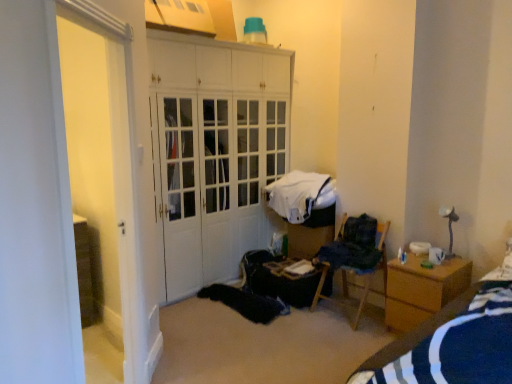
Question: Is the depth of wooden nightstand at right less than that of blue striped fabric at lower right?

Choices:
 (A) yes
 (B) no

Answer: (B)

Question: Is wooden nightstand at right with blue striped fabric at lower right?

Choices:
 (A) yes
 (B) no

Answer: (B)

Question: Is wooden nightstand at right shorter than blue striped fabric at lower right?

Choices:
 (A) no
 (B) yes

Answer: (B)

Question: Considering the relative positions of wooden nightstand at right and blue striped fabric at lower right in the image provided, is wooden nightstand at right to the left of blue striped fabric at lower right from the viewer's perspective?

Choices:
 (A) no
 (B) yes

Answer: (A)

Question: Is wooden nightstand at right not inside blue striped fabric at lower right?

Choices:
 (A) yes
 (B) no

Answer: (A)

Question: Is blue striped fabric at lower right located within wooden nightstand at right?

Choices:
 (A) yes
 (B) no

Answer: (B)

Question: Can you confirm if wooden nightstand at right is taller than white fabric at center, arranged as the second clothing when viewed from the front?

Choices:
 (A) yes
 (B) no

Answer: (A)

Question: Could you tell me if wooden nightstand at right is facing white fabric at center, the first clothing from the back?

Choices:
 (A) no
 (B) yes

Answer: (A)

Question: From a real-world perspective, is wooden nightstand at right physically below white fabric at center, arranged as the second clothing when viewed from the front?

Choices:
 (A) yes
 (B) no

Answer: (A)

Question: Can you confirm if wooden nightstand at right is wider than white fabric at center, the first clothing from the back?

Choices:
 (A) yes
 (B) no

Answer: (B)

Question: Considering the relative sizes of wooden nightstand at right and white fabric at center, arranged as the second clothing when viewed from the front, in the image provided, is wooden nightstand at right smaller than white fabric at center, arranged as the second clothing when viewed from the front,?

Choices:
 (A) no
 (B) yes

Answer: (B)

Question: Considering the relative positions of wooden nightstand at right and white fabric at center, arranged as the second clothing when viewed from the front, in the image provided, is wooden nightstand at right to the right of white fabric at center, arranged as the second clothing when viewed from the front, from the viewer's perspective?

Choices:
 (A) no
 (B) yes

Answer: (B)

Question: Can you confirm if wooden table at center is positioned to the right of white glossy door at left?

Choices:
 (A) no
 (B) yes

Answer: (B)